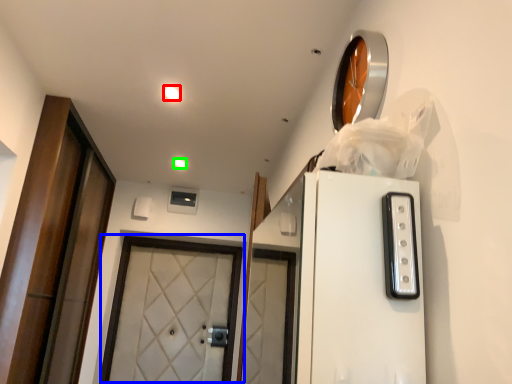
Question: Considering the real-world distances, which object is closest to lighting (highlighted by a red box)? door (highlighted by a blue box) or lighting (highlighted by a green box).

Choices:
 (A) door
 (B) lighting

Answer: (B)